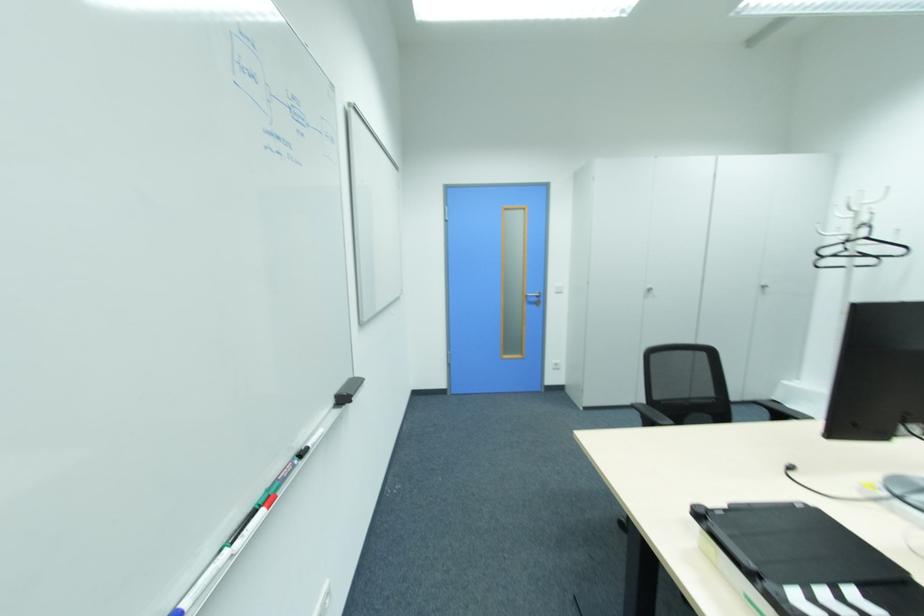
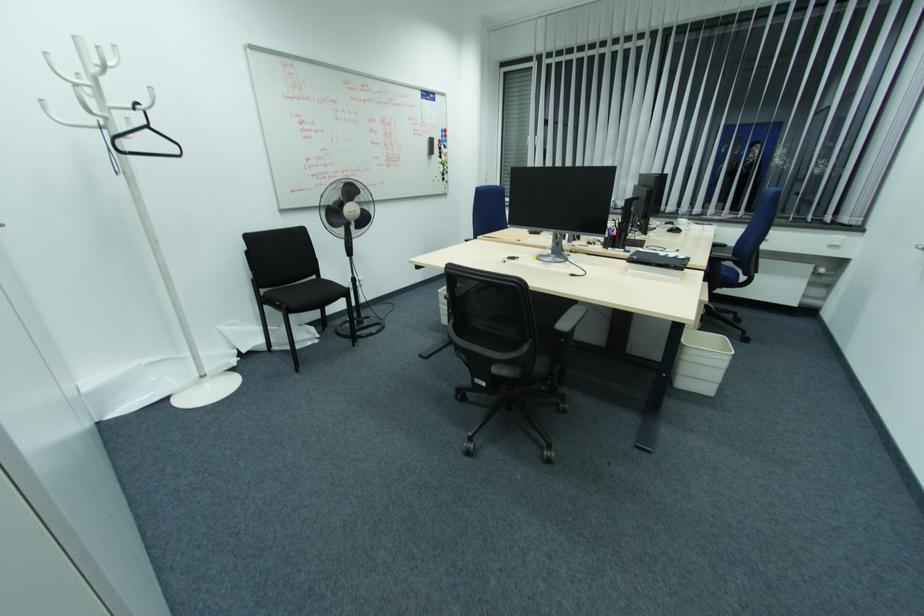
The point at (725,506) is marked in the first image. Where is the corresponding point in the second image?

(669, 265)